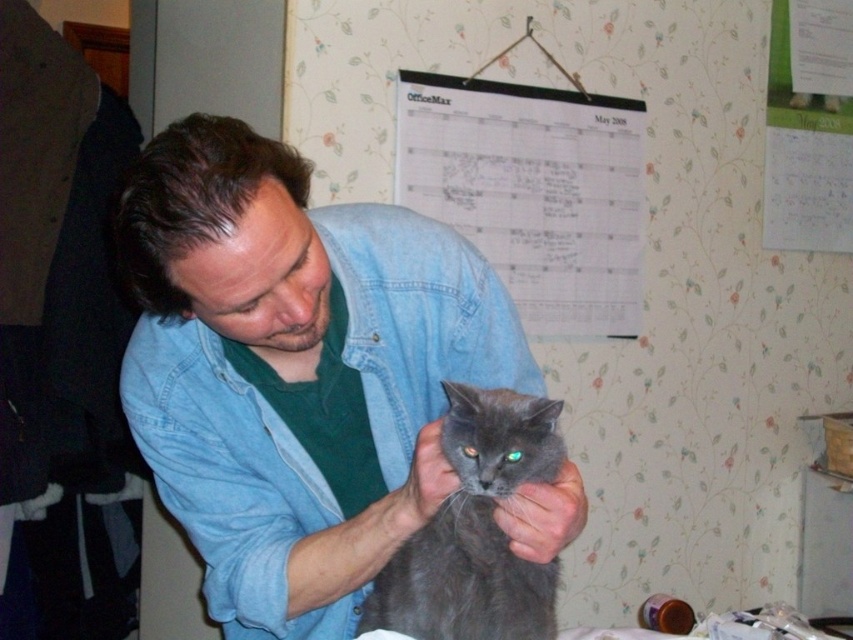
Between faded denim jacket at center and fuzzy gray cat at center, which one appears on the left side from the viewer's perspective?

fuzzy gray cat at center is more to the left.

Is faded denim jacket at center closer to the viewer compared to fuzzy gray cat at center?

Yes, faded denim jacket at center is in front of fuzzy gray cat at center.

Which is in front, point (163, 342) or point (28, 280)?

Point (163, 342)

Find the location of a particular element. faded denim jacket at center is located at coordinates (228, 477).

Which is behind, point (94, 264) or point (502, 584)?

The point (94, 264) is behind.

Does fuzzy gray cat at center come behind gray fluffy cat at center?

Yes, it is behind gray fluffy cat at center.

Image resolution: width=853 pixels, height=640 pixels. What do you see at coordinates (56, 257) in the screenshot?
I see `fuzzy gray cat at center` at bounding box center [56, 257].

You are a GUI agent. You are given a task and a screenshot of the screen. Output one action in this format:
    pyautogui.click(x=<x>, y=<y>)
    Task: Click on the fuzzy gray cat at center
    The width and height of the screenshot is (853, 640).
    Given the screenshot: What is the action you would take?
    pyautogui.click(x=56, y=257)

The height and width of the screenshot is (640, 853). Describe the element at coordinates (228, 477) in the screenshot. I see `faded denim jacket at center` at that location.

Which is behind, point (149, 464) or point (547, 422)?

The point (149, 464) is more distant.

In order to click on faded denim jacket at center in this screenshot , I will do `click(228, 477)`.